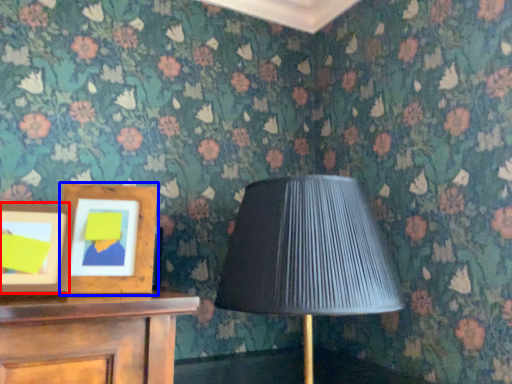
Question: Which object is closer to the camera taking this photo, picture frame (highlighted by a red box) or picture frame (highlighted by a blue box)?

Choices:
 (A) picture frame
 (B) picture frame

Answer: (A)